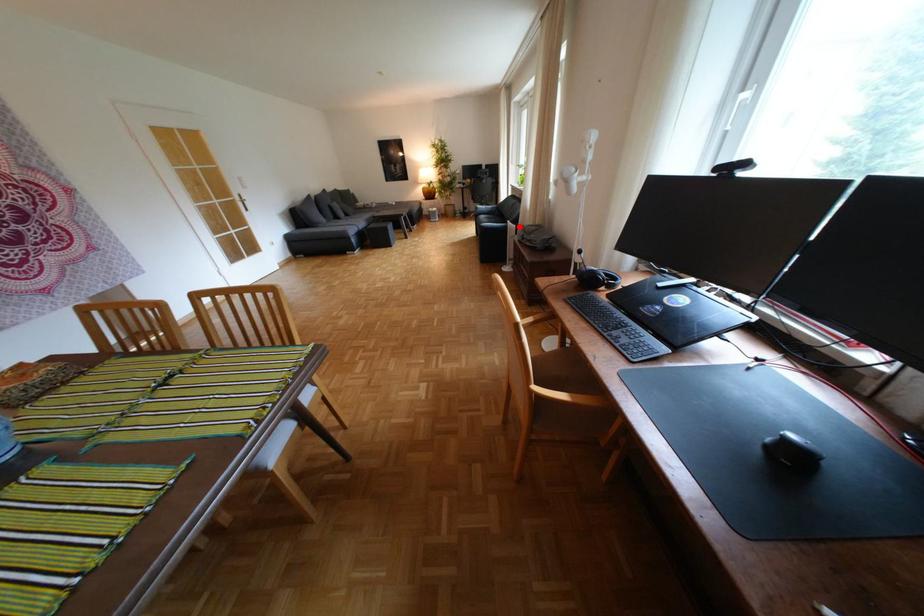
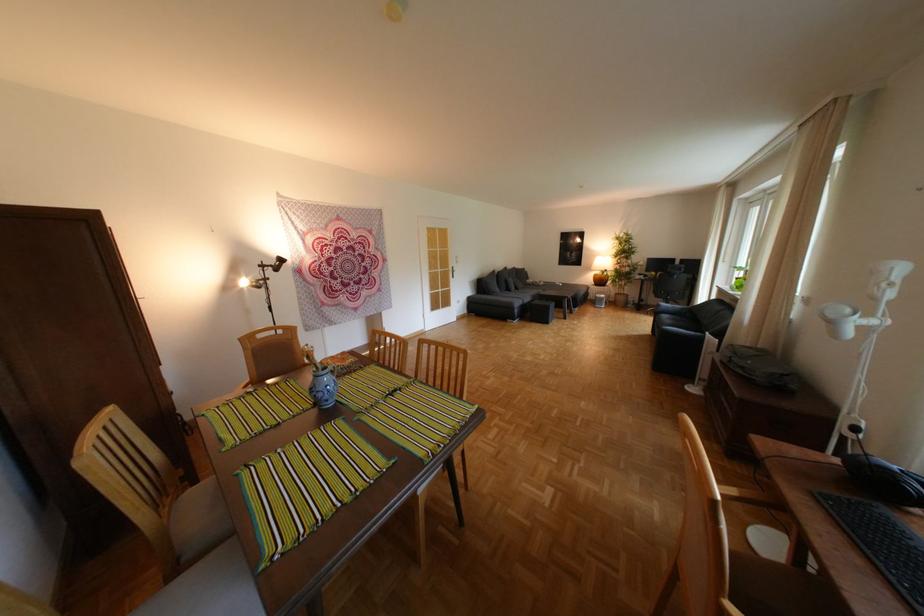
Question: I am providing you with two images of the same scene from different viewpoints. Given a red point in image1, look at the same physical point in image2. Is it:

Choices:
 (A) Closer to the viewpoint
 (B) Farther from the viewpoint

Answer: (B)